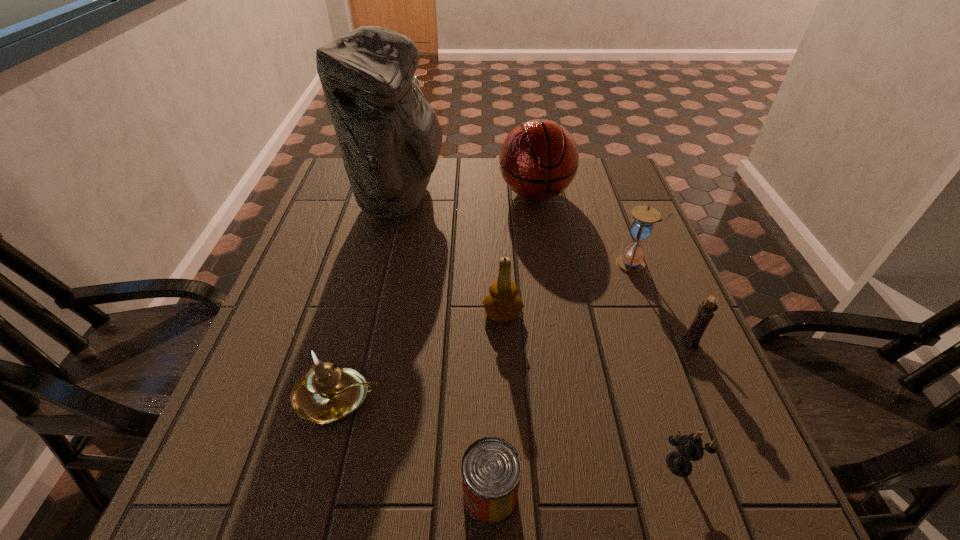
This screenshot has height=540, width=960. In order to click on vacant area in the image that satisfies the following two spatial constraints: 1. on the front-facing side of the can; 2. on the right side of the backpack in this screenshot , I will do `click(330, 495)`.

The width and height of the screenshot is (960, 540). I want to click on free point that satisfies the following two spatial constraints: 1. on the front-facing side of the third farthest object; 2. on the left side of the tallest object, so click(384, 265).

Where is `free location that satisfies the following two spatial constraints: 1. on the back side of the can; 2. on the left side of the second candle holder from right to left`? free location that satisfies the following two spatial constraints: 1. on the back side of the can; 2. on the left side of the second candle holder from right to left is located at coordinates (490, 464).

Where is `free space that satisfies the following two spatial constraints: 1. on the side with spill of the hourglass; 2. on the left side of the basketball`? The width and height of the screenshot is (960, 540). free space that satisfies the following two spatial constraints: 1. on the side with spill of the hourglass; 2. on the left side of the basketball is located at coordinates (547, 265).